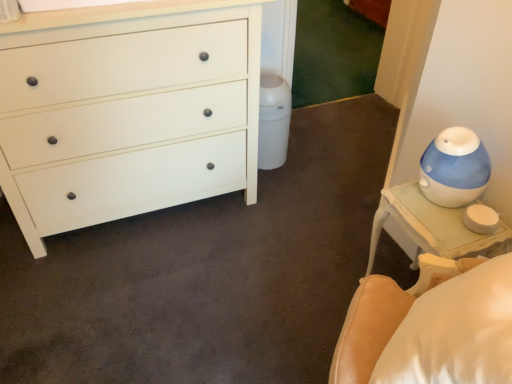
You are a GUI agent. You are given a task and a screenshot of the screen. Output one action in this format:
    pyautogui.click(x=<x>, y=<y>)
    Task: Click on the vacant point above white glossy nightstand at right (from a real-world perspective)
    The image size is (512, 384).
    Given the screenshot: What is the action you would take?
    pyautogui.click(x=445, y=215)